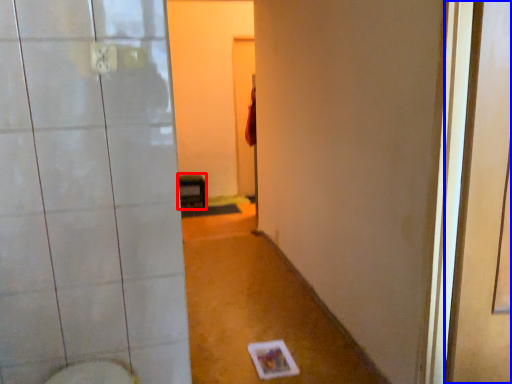
Question: Which object is further to the camera taking this photo, furniture (highlighted by a red box) or screen door (highlighted by a blue box)?

Choices:
 (A) furniture
 (B) screen door

Answer: (A)